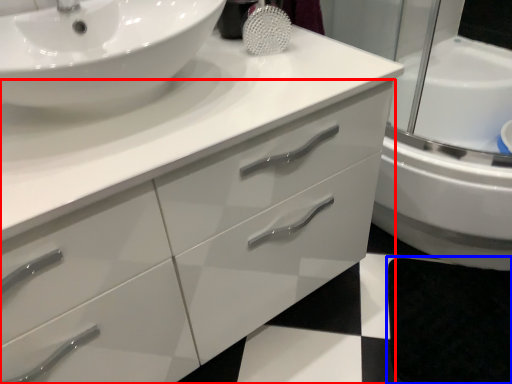
Question: Which point is further to the camera, bathroom cabinet (highlighted by a red box) or bath mat (highlighted by a blue box)?

Choices:
 (A) bathroom cabinet
 (B) bath mat

Answer: (B)